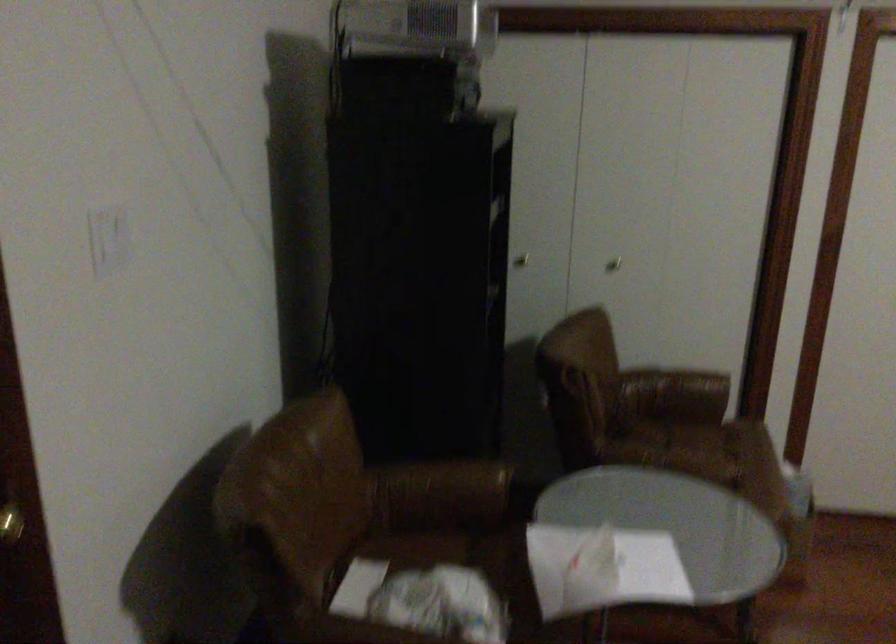
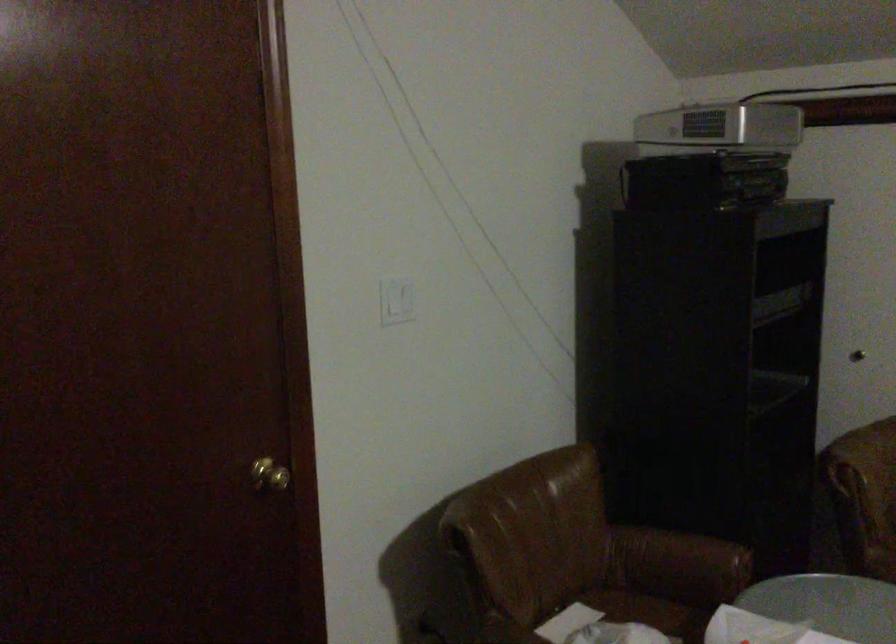
Question: How did the camera likely rotate?

Choices:
 (A) Left
 (B) Right
 (C) Up
 (D) Down

Answer: (A)